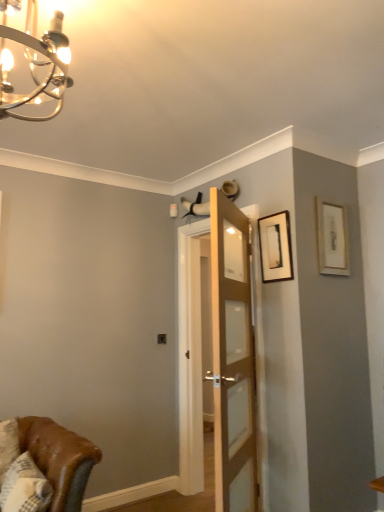
Question: From a real-world perspective, is matte black picture frame at upper right, the 1th picture frame from the left, under chrome/metallic chandelier at upper left?

Choices:
 (A) yes
 (B) no

Answer: (A)

Question: From a real-world perspective, is matte black picture frame at upper right, the 1th picture frame from the left, on chrome/metallic chandelier at upper left?

Choices:
 (A) no
 (B) yes

Answer: (A)

Question: Is chrome/metallic chandelier at upper left inside matte black picture frame at upper right, the 1th picture frame from the left?

Choices:
 (A) yes
 (B) no

Answer: (B)

Question: Is matte black picture frame at upper right, acting as the 2th picture frame starting from the right, taller than chrome/metallic chandelier at upper left?

Choices:
 (A) no
 (B) yes

Answer: (A)

Question: From the image's perspective, is matte black picture frame at upper right, acting as the 2th picture frame starting from the right, located above chrome/metallic chandelier at upper left?

Choices:
 (A) no
 (B) yes

Answer: (A)

Question: Is point (31, 507) positioned closer to the camera than point (188, 462)?

Choices:
 (A) closer
 (B) farther

Answer: (A)

Question: Is white textured pillow at lower left inside or outside of wooden door at center?

Choices:
 (A) inside
 (B) outside

Answer: (B)

Question: Is white textured pillow at lower left taller or shorter than wooden door at center?

Choices:
 (A) short
 (B) tall

Answer: (A)

Question: Considering the positions of white textured pillow at lower left and wooden door at center in the image, is white textured pillow at lower left wider or thinner than wooden door at center?

Choices:
 (A) wide
 (B) thin

Answer: (A)

Question: Is matte gold picture frame at upper right, acting as the first picture frame starting from the right, bigger or smaller than white textured pillow at lower left?

Choices:
 (A) small
 (B) big

Answer: (A)

Question: Is matte gold picture frame at upper right, which ranks as the 2th picture frame in left-to-right order, spatially inside white textured pillow at lower left, or outside of it?

Choices:
 (A) outside
 (B) inside

Answer: (A)

Question: Is point (344, 209) positioned closer to the camera than point (8, 510)?

Choices:
 (A) farther
 (B) closer

Answer: (A)

Question: Is matte gold picture frame at upper right, acting as the first picture frame starting from the right, wider or thinner than white textured pillow at lower left?

Choices:
 (A) thin
 (B) wide

Answer: (A)

Question: In the image, is matte black picture frame at upper right, acting as the 2th picture frame starting from the right, positioned in front of or behind matte gold picture frame at upper right, acting as the first picture frame starting from the right?

Choices:
 (A) behind
 (B) front

Answer: (B)

Question: In terms of width, does matte black picture frame at upper right, acting as the 2th picture frame starting from the right, look wider or thinner when compared to matte gold picture frame at upper right, which ranks as the 2th picture frame in left-to-right order?

Choices:
 (A) thin
 (B) wide

Answer: (B)